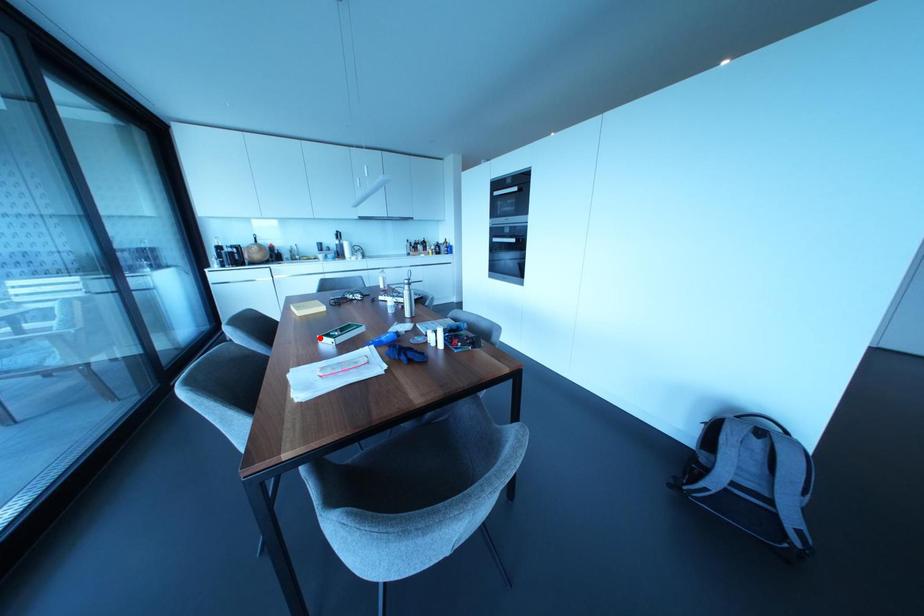
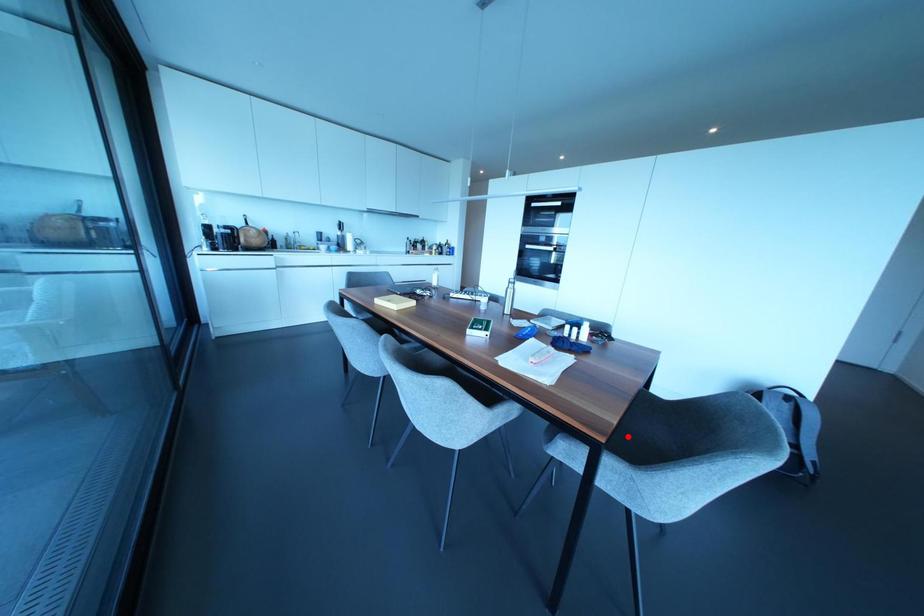
I am providing you with two images of the same scene from different viewpoints. A red point is marked on the first image and another point is marked on the second image. Does the point marked in image1 correspond to the same location as the one in image2?

No